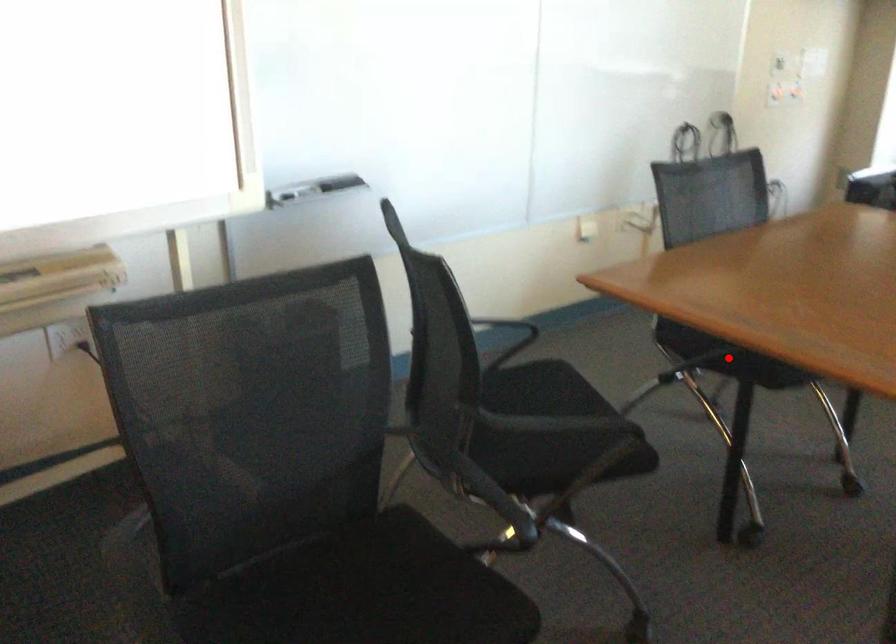
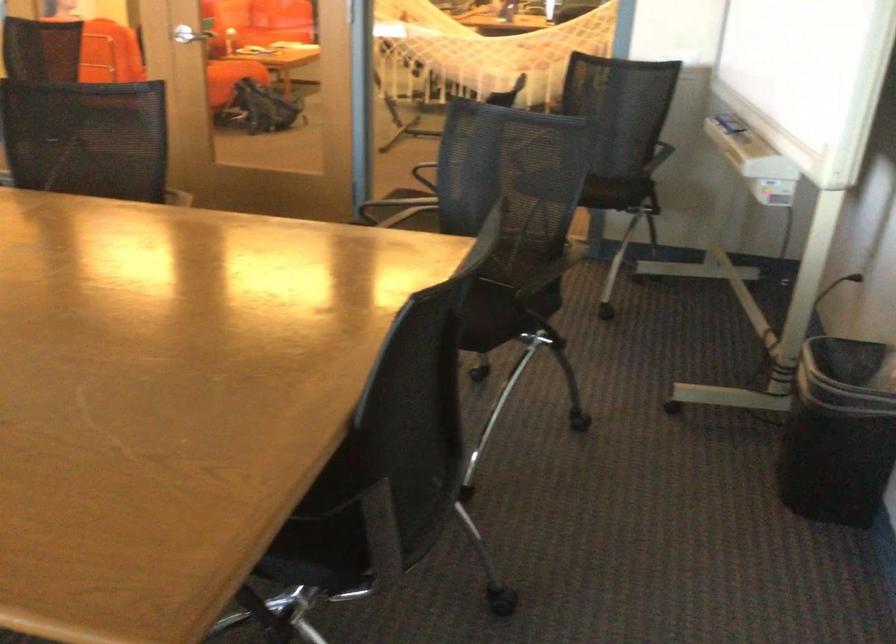
Question: I am providing you with two images of the same scene from different viewpoints. A red point is marked on the first image. Can you still see the location of the red point in image 2?

Choices:
 (A) Yes
 (B) No

Answer: (B)